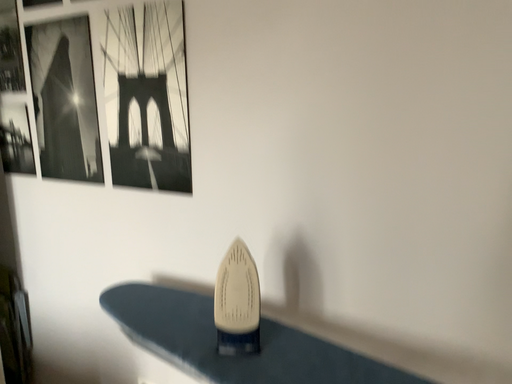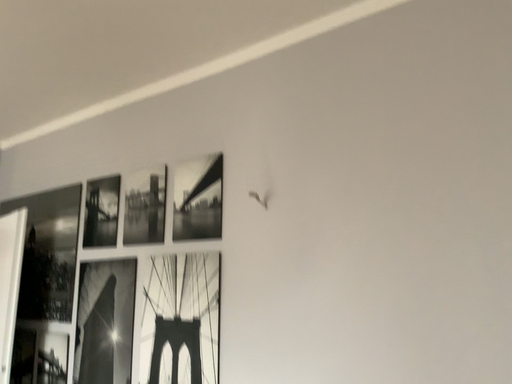
Question: Which way did the camera rotate in the video?

Choices:
 (A) rotated left
 (B) rotated right

Answer: (A)